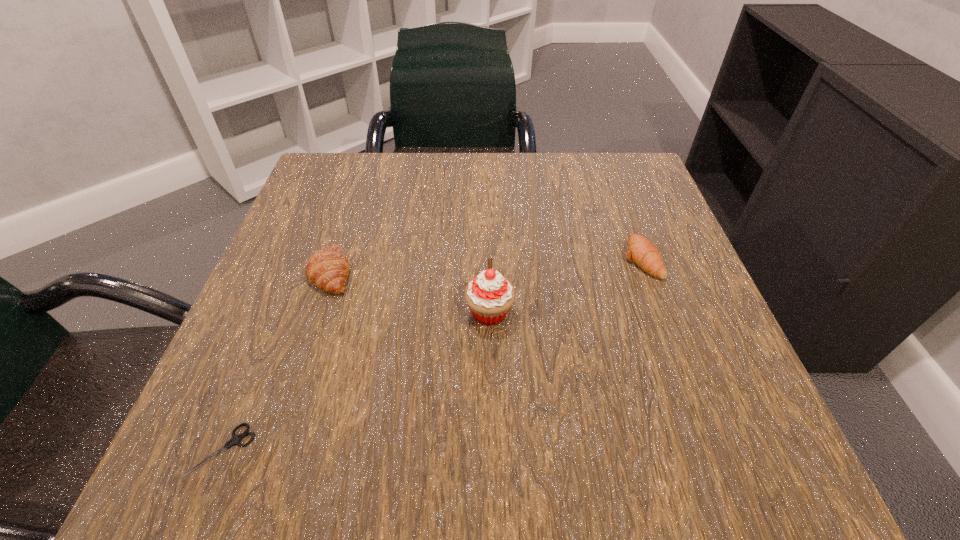
The height and width of the screenshot is (540, 960). In order to click on free space located on the back of the rightmost object in this screenshot , I will do click(615, 190).

Locate an element on the screen. vacant area situated on the back of the nearest object is located at coordinates (306, 242).

This screenshot has width=960, height=540. Find the location of `object situated at the near edge`. object situated at the near edge is located at coordinates (235, 439).

The width and height of the screenshot is (960, 540). I want to click on crescent roll located in the left edge section of the desktop, so click(x=327, y=269).

This screenshot has width=960, height=540. Find the location of `shears situated at the left edge`. shears situated at the left edge is located at coordinates (235, 439).

In order to click on object situated at the right edge in this screenshot , I will do `click(641, 251)`.

Where is `object that is at the near left corner`? object that is at the near left corner is located at coordinates (235, 439).

Find the location of a particular element. free region at the far edge of the desktop is located at coordinates (530, 201).

At what (x,y) coordinates should I click in order to perform the action: click on vacant space at the near edge of the desktop. Please return your answer as a coordinate pair (x, y). This screenshot has height=540, width=960. Looking at the image, I should click on (412, 428).

Locate an element on the screen. The height and width of the screenshot is (540, 960). free space at the left edge of the desktop is located at coordinates (302, 264).